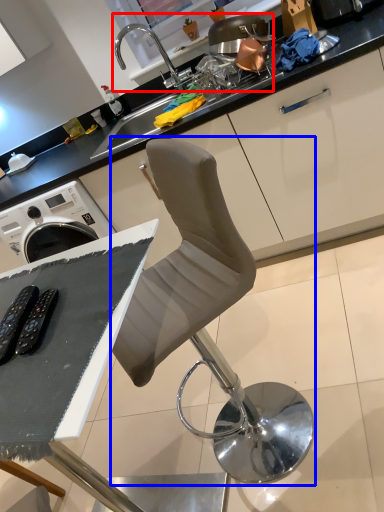
Question: Which object is further to the camera taking this photo, sink (highlighted by a red box) or chair (highlighted by a blue box)?

Choices:
 (A) sink
 (B) chair

Answer: (A)